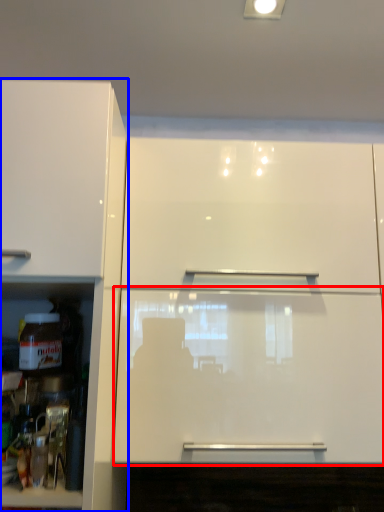
Question: Which object appears farthest to the camera in this image, glass door (highlighted by a red box) or cabinetry (highlighted by a blue box)?

Choices:
 (A) glass door
 (B) cabinetry

Answer: (A)